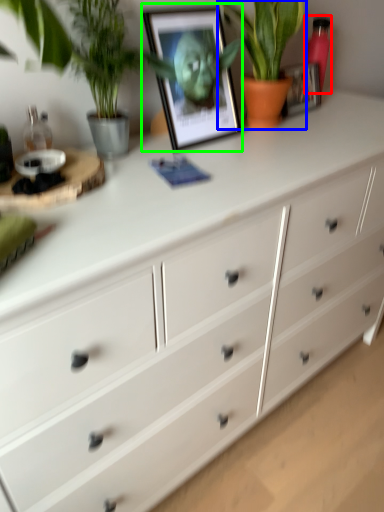
Question: Which object is positioned farthest from bottle (highlighted by a red box)? Select from houseplant (highlighted by a blue box) and picture frame (highlighted by a green box).

Choices:
 (A) houseplant
 (B) picture frame

Answer: (B)